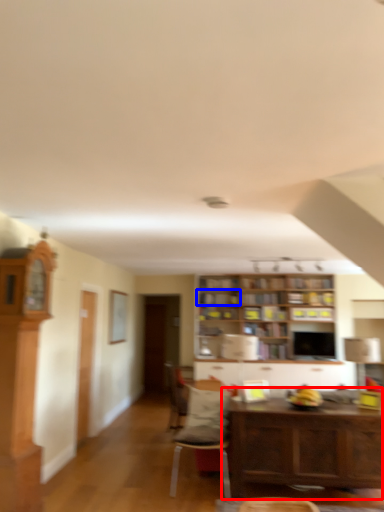
Question: Which point is further to the camera, table (highlighted by a red box) or shelf (highlighted by a blue box)?

Choices:
 (A) table
 (B) shelf

Answer: (B)